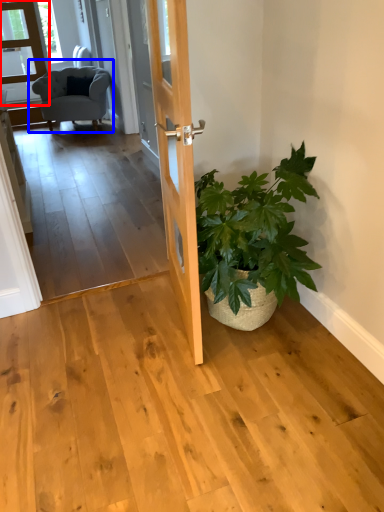
Question: Which of the following is the farthest to the observer, glass door (highlighted by a red box) or chair (highlighted by a blue box)?

Choices:
 (A) glass door
 (B) chair

Answer: (A)